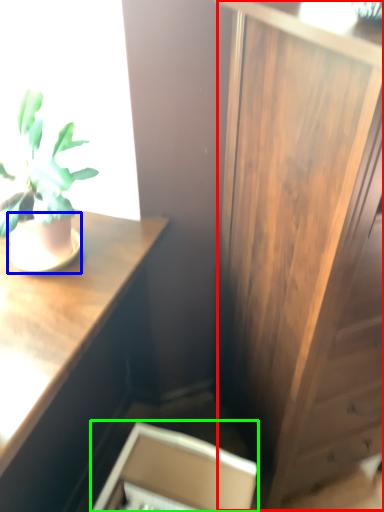
Question: Based on their relative distances, which object is farther from side cabinet (highlighted by a red box)? Choose from flowerpot (highlighted by a blue box) and cabinetry (highlighted by a green box).

Choices:
 (A) flowerpot
 (B) cabinetry

Answer: (A)